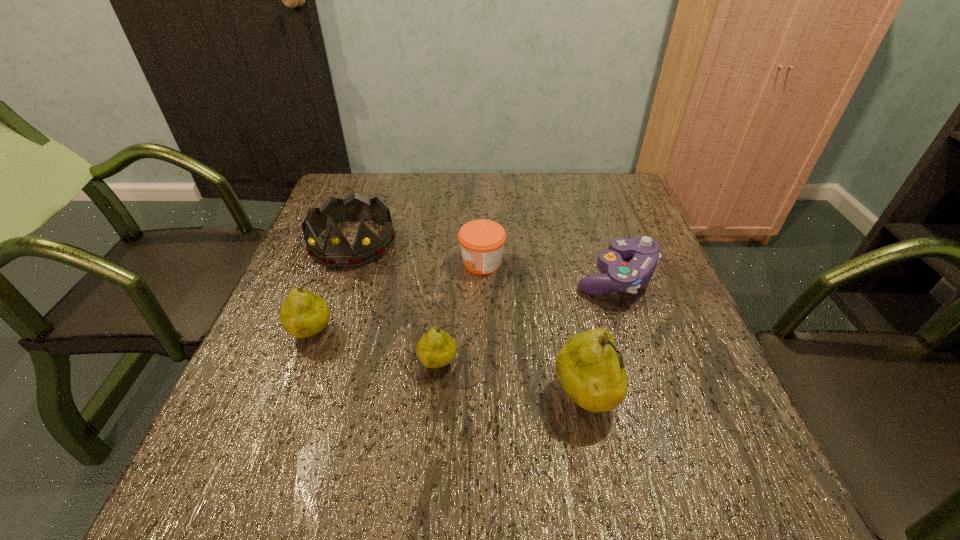
You are a GUI agent. You are given a task and a screenshot of the screen. Output one action in this format:
    pyautogui.click(x=<x>, y=<y>)
    Task: Click on the vacant area in the image that satisfies the following two spatial constraints: 1. on the front label of the tallest pear; 2. on the right side of the jam
    This screenshot has width=960, height=540.
    Given the screenshot: What is the action you would take?
    pyautogui.click(x=483, y=399)

Identify the location of free spot that satisfies the following two spatial constraints: 1. at the front of the fifth shortest object with jewels; 2. on the left side of the tallest pear. The width and height of the screenshot is (960, 540). (298, 399).